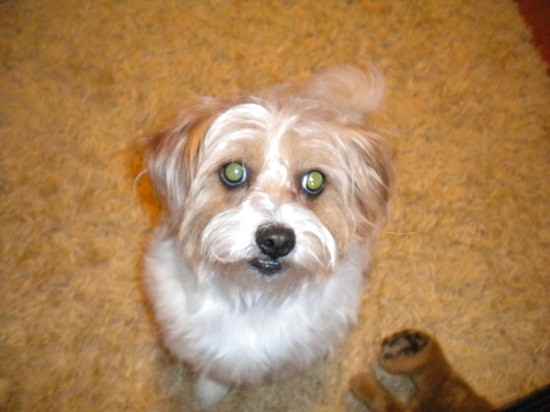
Identify the location of orange shag carpet. The height and width of the screenshot is (412, 550). (467, 246).